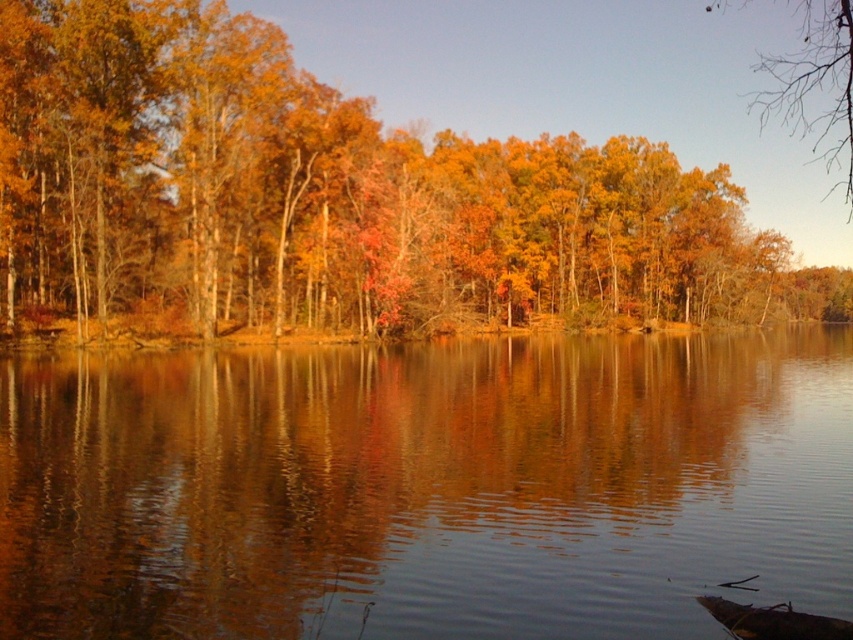
Question: Is shiny reflective water at center below golden leaves at upper center?

Choices:
 (A) no
 (B) yes

Answer: (B)

Question: Which of the following is the farthest from the observer?

Choices:
 (A) (172, 118)
 (B) (778, 54)
 (C) (32, 614)

Answer: (B)

Question: Does shiny reflective water at center have a greater width compared to golden leaves at upper center?

Choices:
 (A) no
 (B) yes

Answer: (A)

Question: Can you confirm if shiny reflective water at center is smaller than bare branches at upper right?

Choices:
 (A) no
 (B) yes

Answer: (B)

Question: Among these points, which one is farthest from the camera?

Choices:
 (A) (45, 90)
 (B) (845, 115)
 (C) (554, 390)

Answer: (B)

Question: Which of these objects is positioned closest to the bare branches at upper right?

Choices:
 (A) golden leaves at upper center
 (B) shiny reflective water at center

Answer: (A)